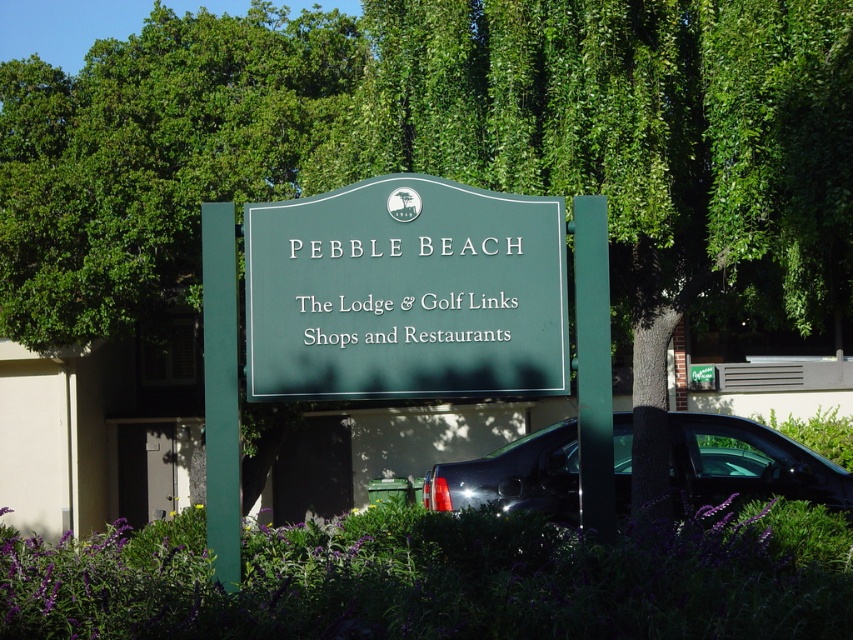
Who is more forward, (523,582) or (312,234)?

Point (523,582)

Can you confirm if purple leafy bush at lower center is positioned to the right of green polished wood sign at center?

Correct, you'll find purple leafy bush at lower center to the right of green polished wood sign at center.

The image size is (853, 640). Find the location of `purple leafy bush at lower center`. purple leafy bush at lower center is located at coordinates (437, 580).

Is purple leafy bush at lower center taller than glossy black truck at lower right?

In fact, purple leafy bush at lower center may be shorter than glossy black truck at lower right.

Between point (723, 605) and point (508, 497), which one is positioned in front?

Positioned in front is point (723, 605).

Locate an element on the screen. This screenshot has width=853, height=640. purple leafy bush at lower center is located at coordinates (437, 580).

Locate an element on the screen. purple leafy bush at lower center is located at coordinates (437, 580).

Does green polished wood sign at center have a lesser width compared to glossy black truck at lower right?

Yes, green polished wood sign at center is thinner than glossy black truck at lower right.

Is green polished wood sign at center closer to camera compared to glossy black truck at lower right?

Yes, it is.

Between point (287, 214) and point (753, 497), which one is positioned in front?

Point (287, 214)

Find the location of a particular element. green polished wood sign at center is located at coordinates (405, 292).